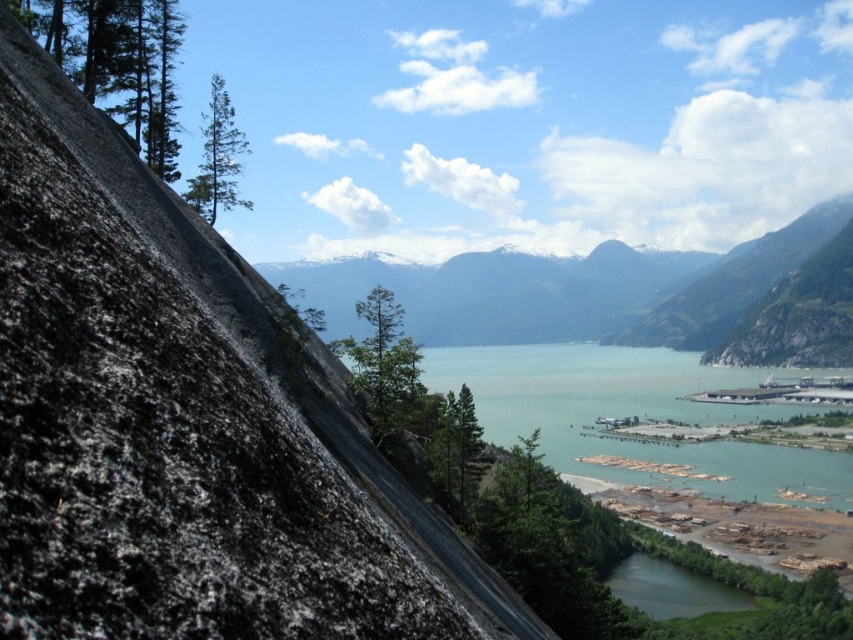
Question: Does black granite rock at left come in front of greenish-blue water at center?

Choices:
 (A) yes
 (B) no

Answer: (A)

Question: Does black granite rock at left have a smaller size compared to greenish-blue water at center?

Choices:
 (A) yes
 (B) no

Answer: (A)

Question: Which object is positioned farthest from the black granite rock at left?

Choices:
 (A) greenish-blue water at center
 (B) snowy granite mountain at upper center

Answer: (B)

Question: Which object is closer to the camera taking this photo?

Choices:
 (A) snowy granite mountain at upper center
 (B) greenish-blue water at center

Answer: (B)

Question: Does black granite rock at left appear on the left side of snowy granite mountain at upper center?

Choices:
 (A) no
 (B) yes

Answer: (B)

Question: Which point is farther from the camera taking this photo?

Choices:
 (A) (759, 493)
 (B) (706, 257)

Answer: (B)